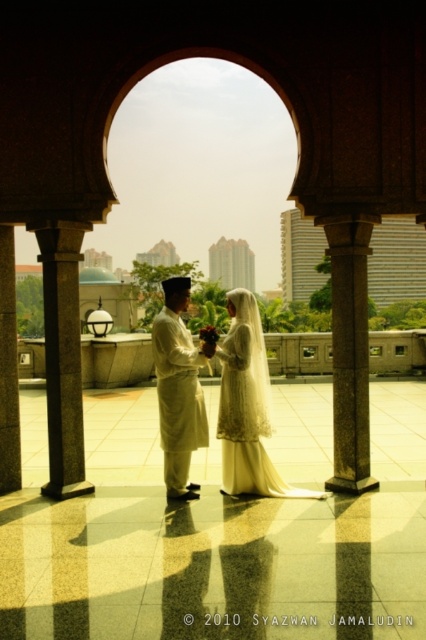
Who is higher up, granite column at left or smooth stone pillar at left?

granite column at left is higher up.

Describe the element at coordinates (63, 355) in the screenshot. The image size is (426, 640). I see `granite column at left` at that location.

Describe the element at coordinates (63, 355) in the screenshot. I see `granite column at left` at that location.

I want to click on granite column at left, so click(63, 355).

Can you confirm if brown polished stone pillar at center is taller than granite column at left?

Correct, brown polished stone pillar at center is much taller as granite column at left.

Does brown polished stone pillar at center have a greater width compared to granite column at left?

Indeed, brown polished stone pillar at center has a greater width compared to granite column at left.

Describe the element at coordinates (350, 349) in the screenshot. The image size is (426, 640). I see `brown polished stone pillar at center` at that location.

Where is `brown polished stone pillar at center`? brown polished stone pillar at center is located at coordinates (350, 349).

Which is more to the right, beige cotton kurta at center or smooth stone pillar at left?

beige cotton kurta at center is more to the right.

Can you confirm if beige cotton kurta at center is taller than smooth stone pillar at left?

No.

Is point (178, 403) in front of point (9, 456)?

Yes, it is.

Locate an element on the screen. beige cotton kurta at center is located at coordinates (178, 388).